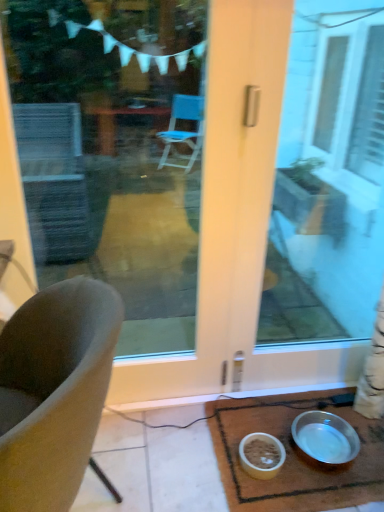
Question: Is point (97, 77) closer or farther from the camera than point (321, 412)?

Choices:
 (A) farther
 (B) closer

Answer: (A)

Question: Is transparent glass door at center, positioned as the 2th window screen in right-to-left order, in front of or behind silver metallic bowl at lower right, arranged as the 1th bowl when viewed from the right, in the image?

Choices:
 (A) front
 (B) behind

Answer: (A)

Question: Which object is positioned closest to the transparent glass door at center, positioned as the 2th window screen in right-to-left order?

Choices:
 (A) silver metallic bowl at lower right, the 2th bowl in the left-to-right sequence
 (B) soft gray cushion at left
 (C) transparent glass door at center, placed as the second window screen when sorted from left to right
 (D) matte brown bowl at lower center, arranged as the second bowl when viewed from the right
 (E) metallic silver bowl at lower right

Answer: (C)

Question: Considering the real-world distances, which object is farthest from the transparent glass door at center, placed as the second window screen when sorted from left to right?

Choices:
 (A) soft gray cushion at left
 (B) transparent glass door at center, positioned as the 2th window screen in right-to-left order
 (C) silver metallic bowl at lower right, the 2th bowl in the left-to-right sequence
 (D) matte brown bowl at lower center, arranged as the second bowl when viewed from the right
 (E) metallic silver bowl at lower right

Answer: (A)